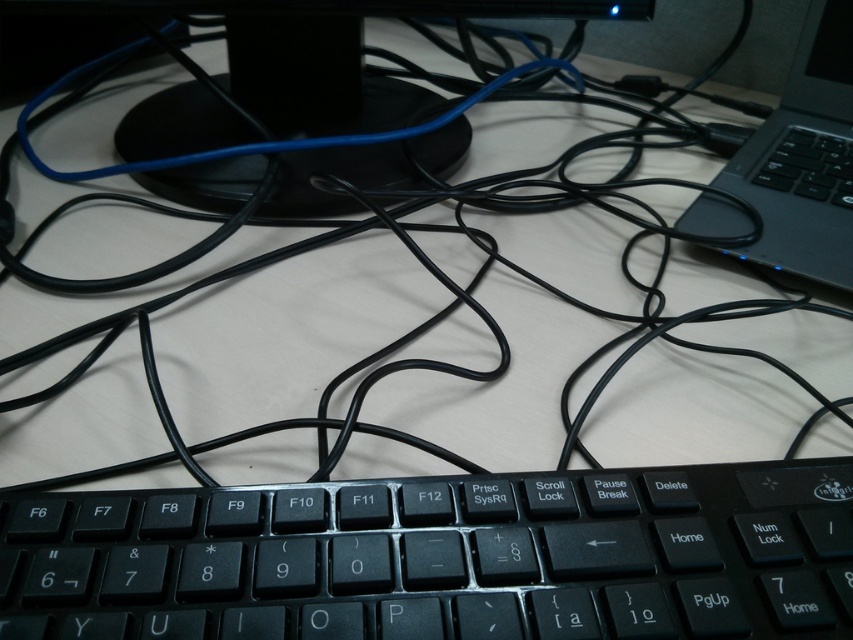
You are trying to locate a specific point in the image. The point is labeled as point [444,557]. Based on the scene description, where would this point be located?

The point [444,557] is on the black matte keyboard at center.

You are organizing your workspace and need to move the black plastic laptop at right to a different location. To do this, you first need to determine its current position relative to the black plastic monitor at upper center. Is the laptop in front of or behind the monitor?

The black plastic laptop at right is behind the black plastic monitor at upper center, so it is positioned behind the monitor.

You are organizing your desk and need to move the black plastic monitor at upper center and the black plastic laptop at right. Which object is positioned more to the left side of the desk?

The black plastic monitor at upper center is positioned more to the left side of the desk compared to the black plastic laptop at right.